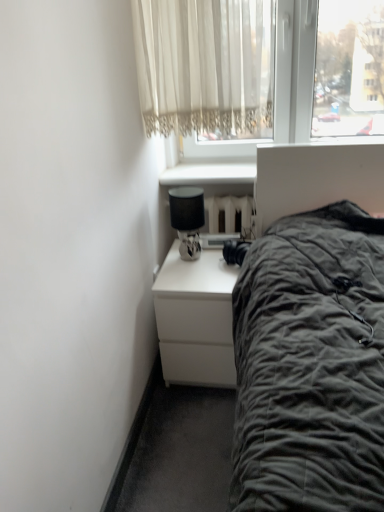
Question: Is white matte nightstand at lower center to the left of matte black lamp at upper right from the viewer's perspective?

Choices:
 (A) no
 (B) yes

Answer: (A)

Question: From the image's perspective, is white matte nightstand at lower center over matte black lamp at upper right?

Choices:
 (A) yes
 (B) no

Answer: (B)

Question: Is white matte nightstand at lower center wider than matte black lamp at upper right?

Choices:
 (A) no
 (B) yes

Answer: (B)

Question: Is white matte nightstand at lower center far away from matte black lamp at upper right?

Choices:
 (A) no
 (B) yes

Answer: (A)

Question: Is white matte nightstand at lower center placed right next to matte black lamp at upper right?

Choices:
 (A) no
 (B) yes

Answer: (A)

Question: Does white matte nightstand at lower center have a lesser width compared to matte black lamp at upper right?

Choices:
 (A) no
 (B) yes

Answer: (A)

Question: Considering the relative sizes of white lace curtain at upper center and matte black lamp at upper right in the image provided, is white lace curtain at upper center shorter than matte black lamp at upper right?

Choices:
 (A) no
 (B) yes

Answer: (A)

Question: Is white lace curtain at upper center positioned with its back to matte black lamp at upper right?

Choices:
 (A) no
 (B) yes

Answer: (A)

Question: Considering the relative sizes of white lace curtain at upper center and matte black lamp at upper right in the image provided, is white lace curtain at upper center thinner than matte black lamp at upper right?

Choices:
 (A) no
 (B) yes

Answer: (A)

Question: From a real-world perspective, is white lace curtain at upper center on top of matte black lamp at upper right?

Choices:
 (A) yes
 (B) no

Answer: (A)

Question: Is white lace curtain at upper center positioned far away from matte black lamp at upper right?

Choices:
 (A) no
 (B) yes

Answer: (A)

Question: Does white lace curtain at upper center lie in front of matte black lamp at upper right?

Choices:
 (A) yes
 (B) no

Answer: (A)

Question: Considering the relative sizes of matte black lamp at upper right and white matte nightstand at lower center in the image provided, is matte black lamp at upper right smaller than white matte nightstand at lower center?

Choices:
 (A) yes
 (B) no

Answer: (A)